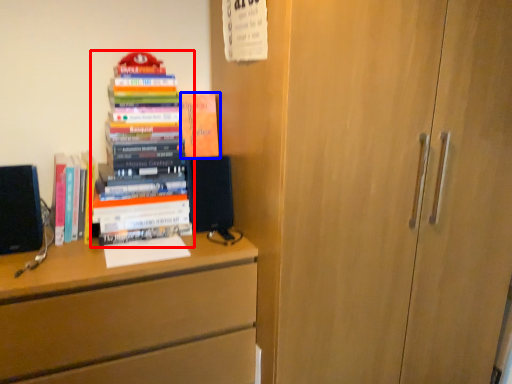
Question: Among these objects, which one is farthest to the camera, book (highlighted by a red box) or book (highlighted by a blue box)?

Choices:
 (A) book
 (B) book

Answer: (B)